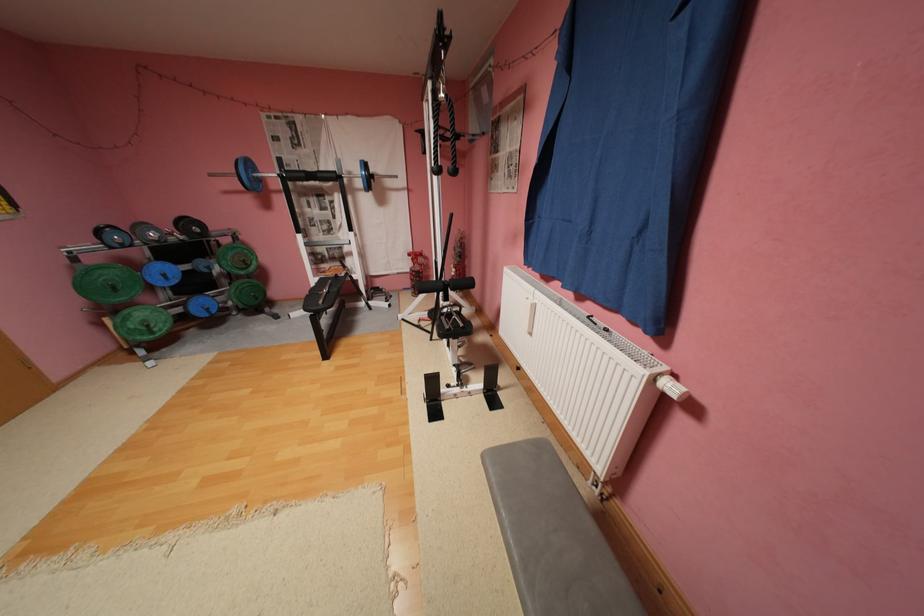
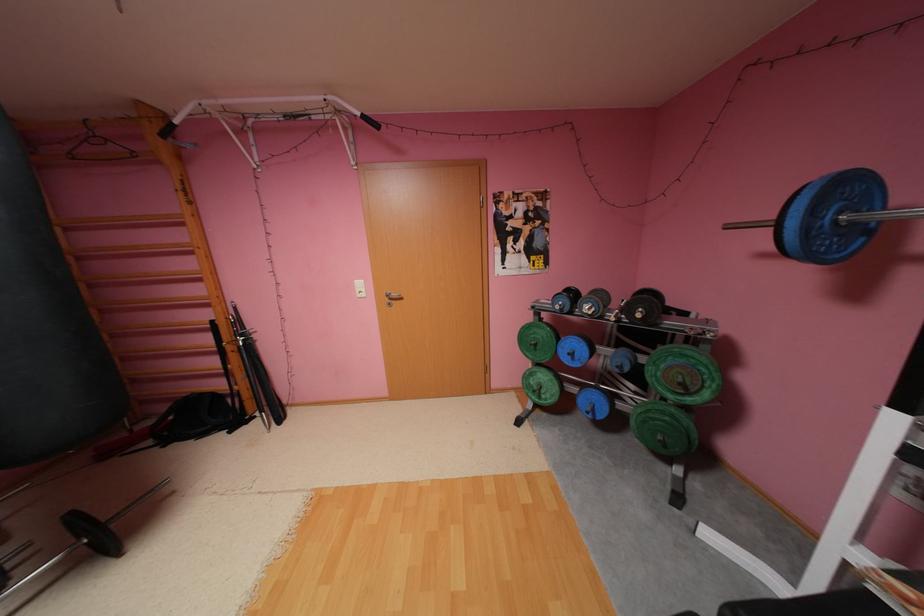
Find the pixel in the second image that matches (x=166, y=241) in the first image.

(600, 315)